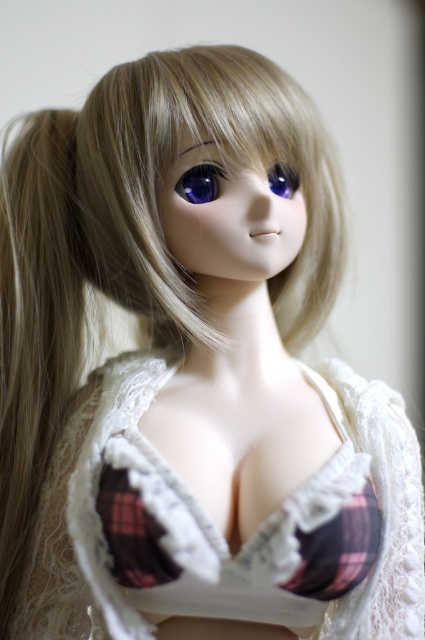
You are a photographer taking a picture of the doll. You notice two points on the doll, one at point (x=365, y=564) and another at point (x=221, y=144). Which point is closer to the camera?

Point (x=365, y=564) is in front of point (x=221, y=144), so it is closer to the camera.

You are standing in front of the doll and want to place a small sticker exactly at point [81,397]. The sticker has a diameter of 1.5 inches. Is there enough space to place the sticker without overlapping any other parts of the doll?

The distance between point [81,397] and the viewer is 32.30 inches. Since the sticker has a diameter of 1.5 inches, there is sufficient space to place it without overlapping any other parts of the doll.